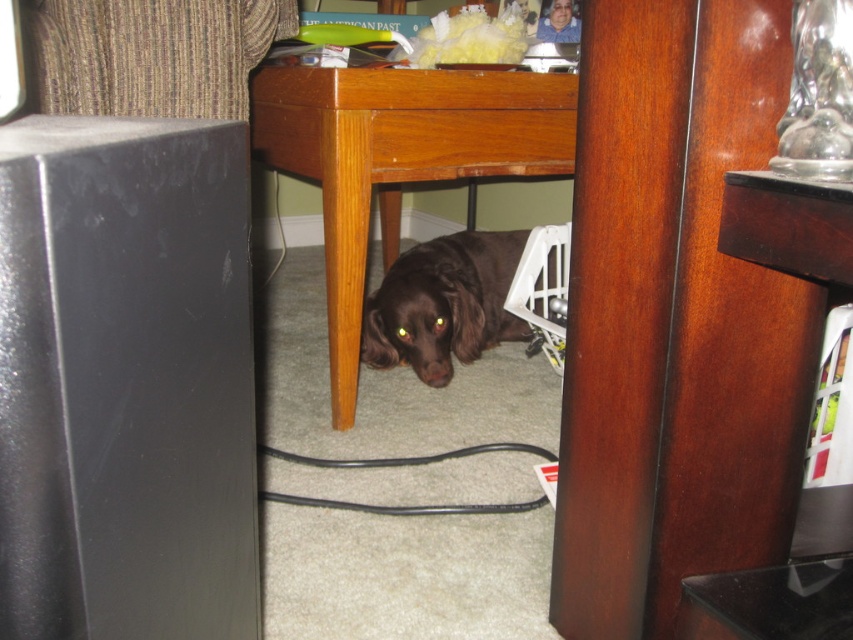
Question: Can you confirm if wooden table at center is positioned to the left of shiny brown dog at lower center?

Choices:
 (A) no
 (B) yes

Answer: (B)

Question: Where is wooden table at center located in relation to shiny brown dog at lower center in the image?

Choices:
 (A) below
 (B) above

Answer: (B)

Question: Is wooden table at center in front of shiny brown dog at lower center?

Choices:
 (A) yes
 (B) no

Answer: (A)

Question: Among these points, which one is nearest to the camera?

Choices:
 (A) (444, 266)
 (B) (386, 257)

Answer: (A)